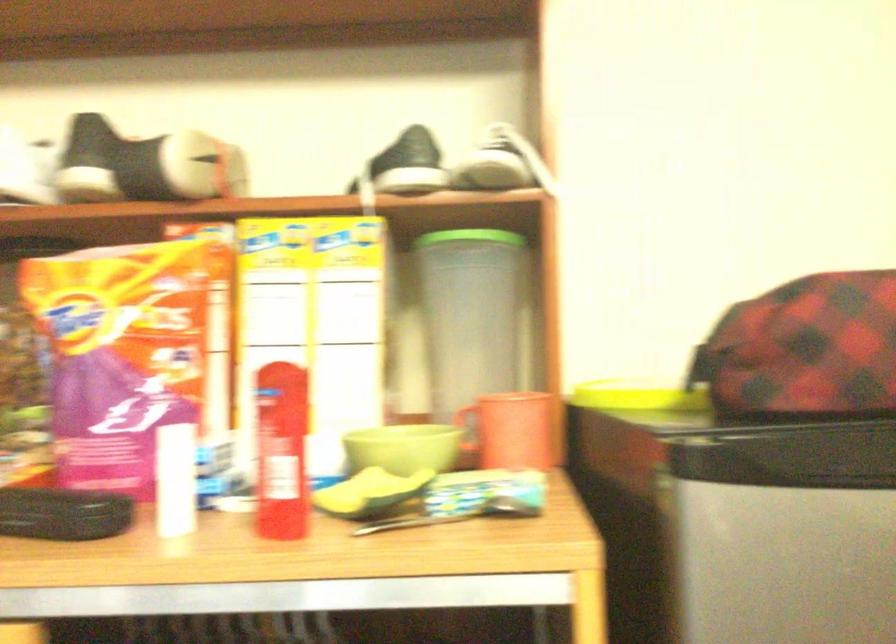
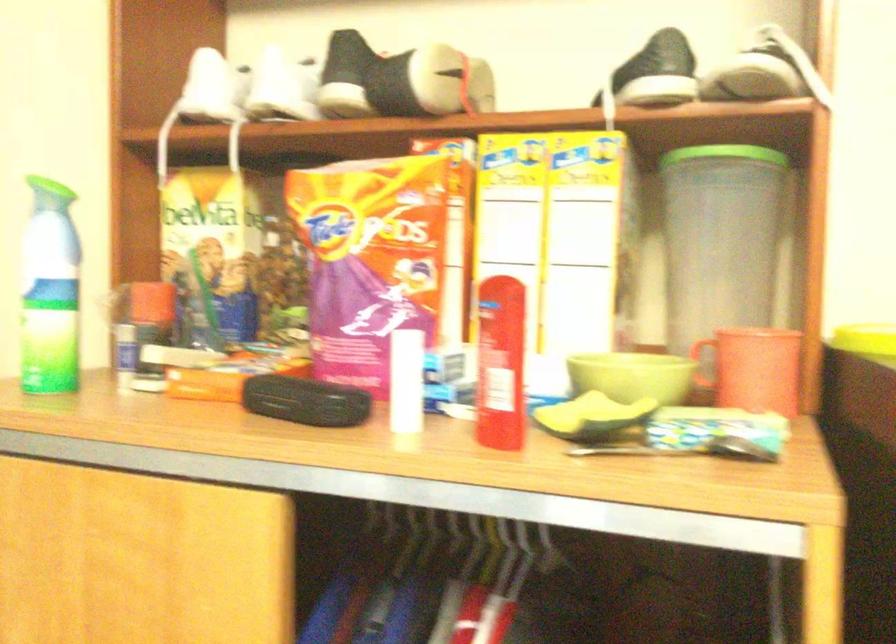
Find the pixel in the second image that matches (x=151, y=164) in the first image.

(401, 80)